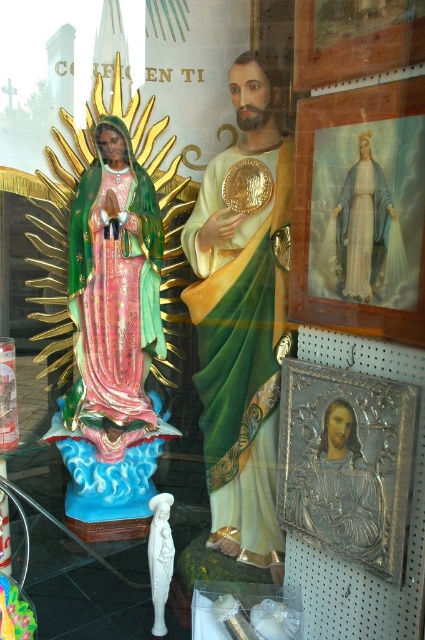
You are a customer in a religious artifacts shop. You see a polished gold statue at center and a shiny pink statue at left. Which statue is positioned to the right of the other?

The polished gold statue at center is positioned to the right of the shiny pink statue at left.

You are an art curator planning to move the polished gold statue at center and the shiny pink statue at left to a new exhibition space. The new space has limited vertical space, so you need to know which statue is placed lower. Which statue is positioned lower in the current display?

The polished gold statue at center is positioned lower than the shiny pink statue at left in the current display.

You are a customer in a shop and want to buy the polished gold statue at center. The shopkeeper says that the statue is placed exactly at the center of the display. Is the shopkeeper telling the truth?

The polished gold statue at center is located at point (x=243, y=323), which is very close to the center coordinates of (x=212, y=320). Therefore, the shopkeeper is telling the truth.